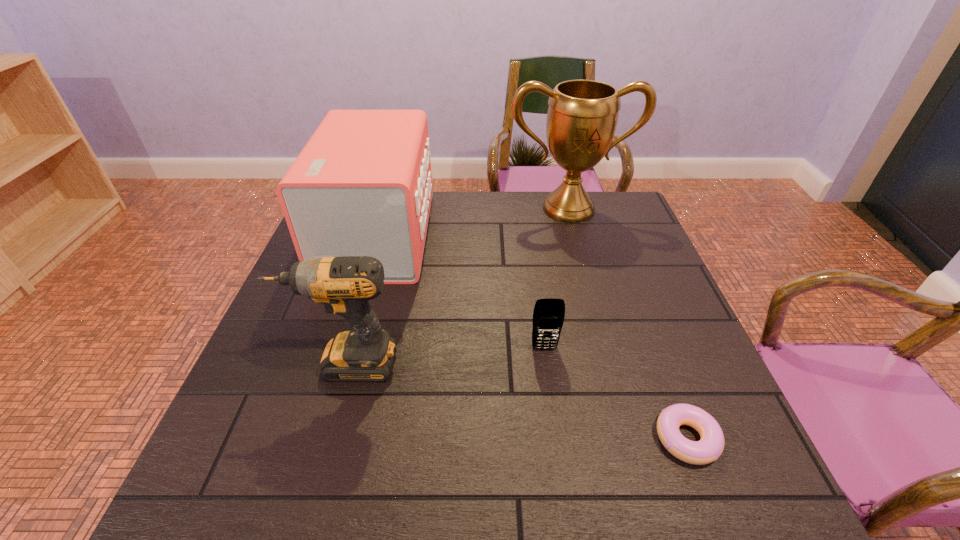
Find the location of a particular element. free space located 0.180m on the screen of the fourth tallest object is located at coordinates (556, 427).

This screenshot has height=540, width=960. Identify the location of vacant space positioned 0.120m on the back of the shortest object. (658, 363).

Where is `trophy cup positioned at the far edge`? Image resolution: width=960 pixels, height=540 pixels. trophy cup positioned at the far edge is located at coordinates (582, 116).

Where is `box located at the far edge`? The width and height of the screenshot is (960, 540). box located at the far edge is located at coordinates (362, 186).

The image size is (960, 540). I want to click on object situated at the near edge, so click(x=709, y=448).

Where is `box at the left edge`? The width and height of the screenshot is (960, 540). box at the left edge is located at coordinates (362, 186).

At what (x,y) coordinates should I click in order to perform the action: click on drill at the left edge. Please return your answer as a coordinate pair (x, y). Looking at the image, I should click on (344, 285).

Where is `trophy cup present at the right edge`? The height and width of the screenshot is (540, 960). trophy cup present at the right edge is located at coordinates 582,116.

Find the location of a particular element. doughnut situated at the right edge is located at coordinates (709, 448).

At what (x,y) coordinates should I click in order to perform the action: click on object that is at the far left corner. Please return your answer as a coordinate pair (x, y). The height and width of the screenshot is (540, 960). Looking at the image, I should click on (362, 186).